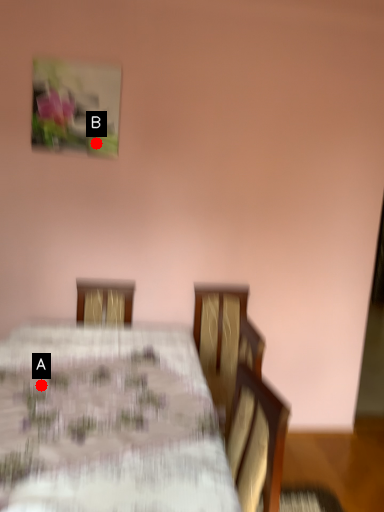
Question: Two points are circled on the image, labeled by A and B beside each circle. Among these points, which one is farthest from the camera?

Choices:
 (A) A is further
 (B) B is further

Answer: (B)